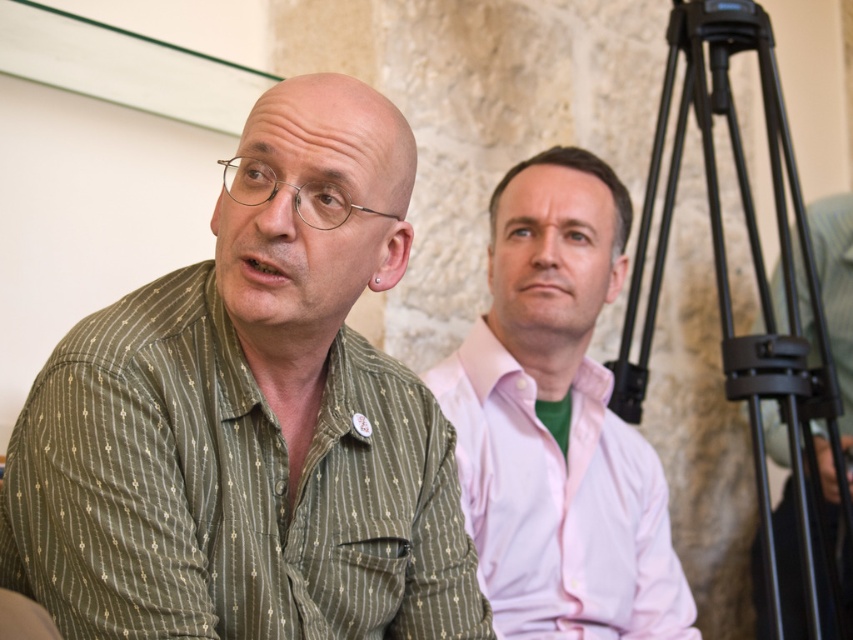
Consider the image. Can you confirm if pink smooth shirt at center is positioned to the right of black metal tripod at right?

Incorrect, pink smooth shirt at center is not on the right side of black metal tripod at right.

Is pink smooth shirt at center below black metal tripod at right?

Yes.

Is point (498, 481) more distant than point (758, 12)?

No, it is in front of (758, 12).

Locate an element on the screen. The width and height of the screenshot is (853, 640). pink smooth shirt at center is located at coordinates (560, 504).

Locate an element on the screen. The image size is (853, 640). green striped shirt at left is located at coordinates (250, 422).

Between point (126, 497) and point (488, 387), which one is positioned in front?

Point (126, 497)

Does point (425, 464) come farther from viewer compared to point (483, 584)?

No.

Where is `green striped shirt at left`? Image resolution: width=853 pixels, height=640 pixels. green striped shirt at left is located at coordinates (250, 422).

Is green striped shirt at left to the right of black metal tripod at right from the viewer's perspective?

No, green striped shirt at left is not to the right of black metal tripod at right.

Who is lower down, green striped shirt at left or black metal tripod at right?

Positioned lower is green striped shirt at left.

Where is `green striped shirt at left`? The height and width of the screenshot is (640, 853). green striped shirt at left is located at coordinates (250, 422).